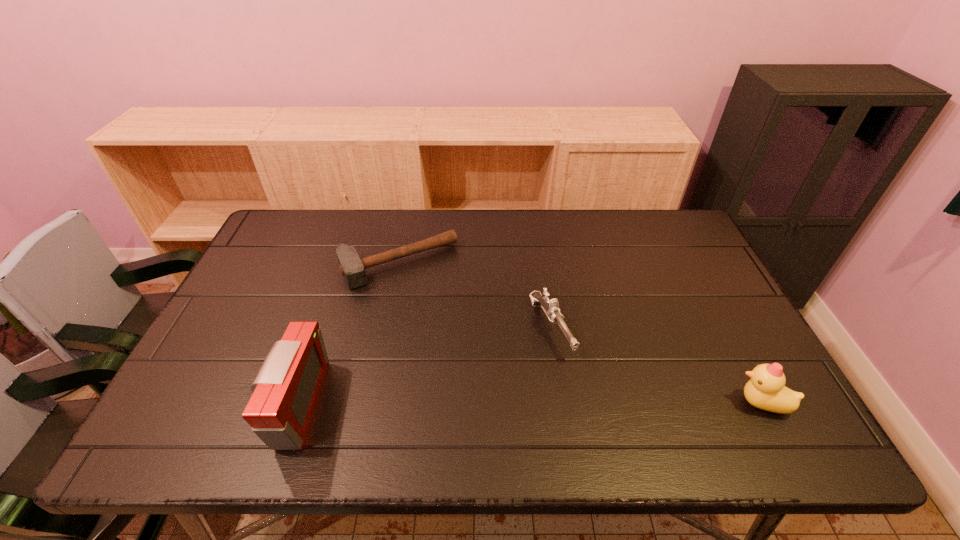
You are a GUI agent. You are given a task and a screenshot of the screen. Output one action in this format:
    pyautogui.click(x=<x>, y=<y>)
    Task: Click on the object that is at the right edge
    Image resolution: width=960 pixels, height=540 pixels.
    Given the screenshot: What is the action you would take?
    pyautogui.click(x=766, y=390)

Identify the location of object that is at the near right corner. The height and width of the screenshot is (540, 960). (766, 390).

Identify the location of vacant space at the far edge of the desktop. (391, 218).

Locate an element on the screen. vacant space at the left edge of the desktop is located at coordinates (274, 308).

Find the location of a particular element. This screenshot has width=960, height=540. free location at the right edge of the desktop is located at coordinates (700, 268).

You are a GUI agent. You are given a task and a screenshot of the screen. Output one action in this format:
    pyautogui.click(x=<x>, y=<y>)
    Task: Click on the free space at the far left corner
    This screenshot has height=540, width=960.
    Given the screenshot: What is the action you would take?
    pyautogui.click(x=278, y=238)

Locate an element on the screen. vacant region at the far right corner is located at coordinates (658, 220).

Identify the location of free space between the shortest object and the gun. (475, 296).

Locate an element on the screen. free space that is in between the camera and the gun is located at coordinates (424, 366).

I want to click on free space between the shortest object and the duckling, so click(x=581, y=334).